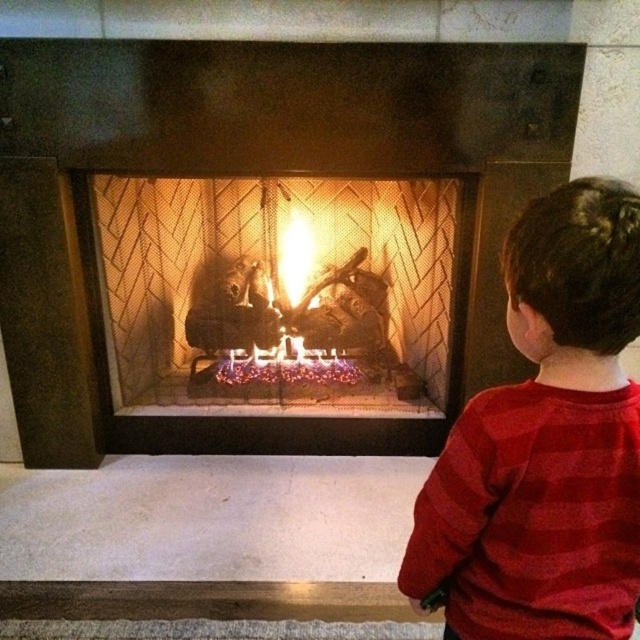
Who is lower down, red striped shirt at right or glowing embers at center?

red striped shirt at right is below.

In the scene shown: Is red striped shirt at right thinner than glowing embers at center?

Indeed, red striped shirt at right has a lesser width compared to glowing embers at center.

Which is in front, point (593, 269) or point (227, 384)?

Point (593, 269) is more forward.

Locate an element on the screen. red striped shirt at right is located at coordinates (547, 442).

Is matte black fireplace at center taller than red striped shirt at right?

Indeed, matte black fireplace at center has a greater height compared to red striped shirt at right.

Looking at this image, who is more forward, (490, 333) or (550, 388)?

Positioned in front is point (550, 388).

Does point (68, 186) come farther from viewer compared to point (556, 260)?

Yes, it is behind point (556, 260).

Find the location of `matte black fireplace at center`. matte black fireplace at center is located at coordinates (256, 173).

Who is positioned more to the right, matte black fireplace at center or glowing embers at center?

From the viewer's perspective, glowing embers at center appears more on the right side.

Between point (225, 70) and point (333, 376), which one is positioned behind?

Point (333, 376)

At what (x,y) coordinates should I click in order to perform the action: click on matte black fireplace at center. Please return your answer as a coordinate pair (x, y). Looking at the image, I should click on (256, 173).